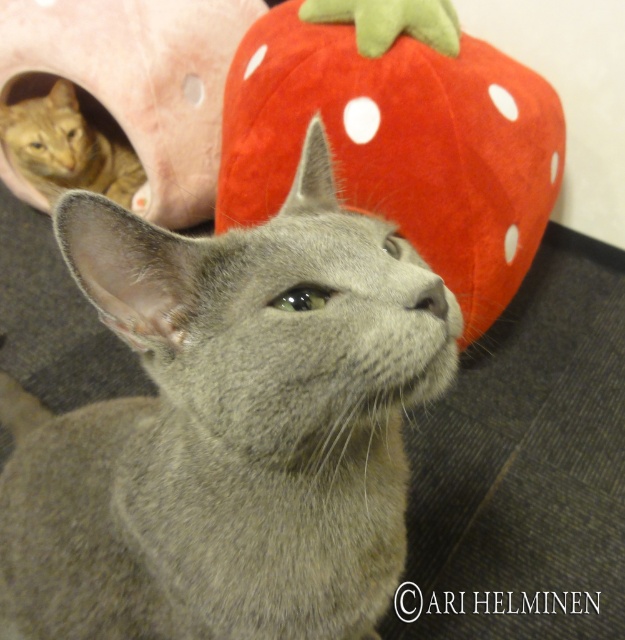
Question: Does gray matte fur cat at center come in front of velvety red strawberry at upper center?

Choices:
 (A) no
 (B) yes

Answer: (B)

Question: Which point is closer to the camera?

Choices:
 (A) pink fabric cat bed at upper left
 (B) orange tabby cat at left
 (C) gray matte fur cat at center

Answer: (C)

Question: Does velvety red strawberry at upper center have a larger size compared to orange tabby cat at left?

Choices:
 (A) no
 (B) yes

Answer: (B)

Question: Is velvety red strawberry at upper center positioned in front of pink fabric cat bed at upper left?

Choices:
 (A) yes
 (B) no

Answer: (A)

Question: Among these objects, which one is farthest from the camera?

Choices:
 (A) orange tabby cat at left
 (B) pink fabric cat bed at upper left
 (C) gray matte fur cat at center
 (D) velvety red strawberry at upper center

Answer: (A)

Question: Which point is closer to the camera?

Choices:
 (A) (22, 188)
 (B) (128, 198)

Answer: (B)